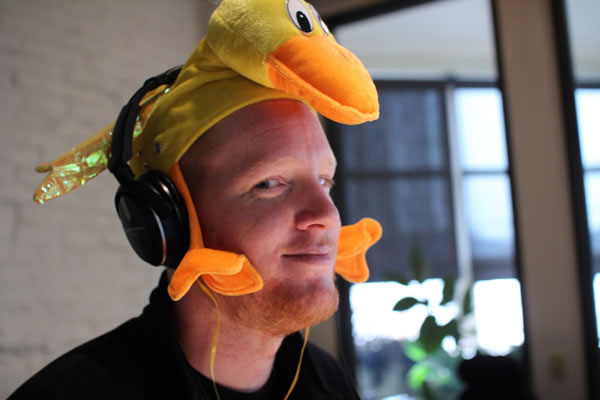
This screenshot has height=400, width=600. I want to click on black right headphone cup, so click(x=152, y=220).